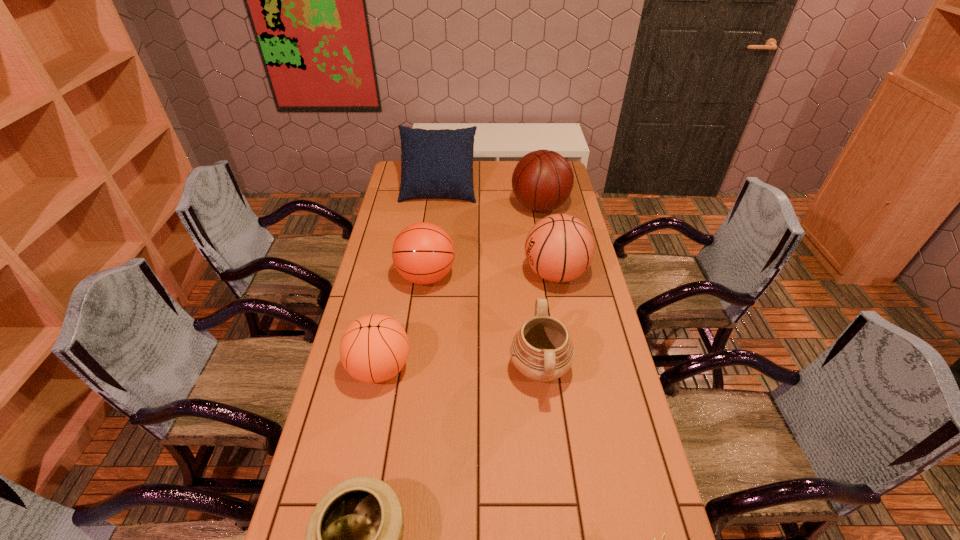
The image size is (960, 540). I want to click on empty space that is in between the urn and the nearest basketball, so click(x=460, y=368).

Locate which object is the second closest to the nearest basketball. Please provide its 2D coordinates. Your answer should be formatted as a tuple, i.e. [(x, y)], where the tuple contains the x and y coordinates of a point satisfying the conditions above.

[(354, 537)]

Locate an element on the screen. The image size is (960, 540). the second closest object relative to the farthest basketball is located at coordinates (559, 248).

The image size is (960, 540). What are the coordinates of `the second closest basketball to the pottery` in the screenshot? It's located at (423, 253).

At what (x,y) coordinates should I click in order to perform the action: click on basketball that is the closest one to the farthest basketball. Please return your answer as a coordinate pair (x, y). This screenshot has width=960, height=540. Looking at the image, I should click on (559, 248).

The width and height of the screenshot is (960, 540). What are the coordinates of `blank space that satisfies the following two spatial constraints: 1. on the facing side of the cushion; 2. on the left side of the farthest basketball` in the screenshot? It's located at (437, 207).